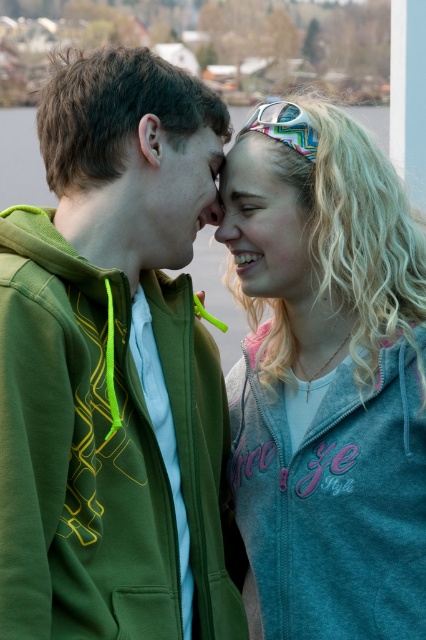
Question: Which object appears closest to the camera in this image?

Choices:
 (A) smooth skin nose at center
 (B) translucent plastic goggles at upper center
 (C) green fleece jacket at left
 (D) matte green hoodie at center

Answer: (C)

Question: Which object appears closest to the camera in this image?

Choices:
 (A) smooth skin nose at center
 (B) matte green hoodie at center
 (C) matte gray hoodie at upper right

Answer: (B)

Question: Can you confirm if matte gray hoodie at upper right is positioned to the left of smooth skin nose at center?

Choices:
 (A) no
 (B) yes

Answer: (A)

Question: Can you confirm if translucent plastic goggles at upper center is wider than smooth skin nose at center?

Choices:
 (A) no
 (B) yes

Answer: (B)

Question: Which of the following is the closest to the observer?

Choices:
 (A) (268, 200)
 (B) (78, 484)

Answer: (B)

Question: Is green fleece jacket at left above matte green hoodie at center?

Choices:
 (A) yes
 (B) no

Answer: (B)